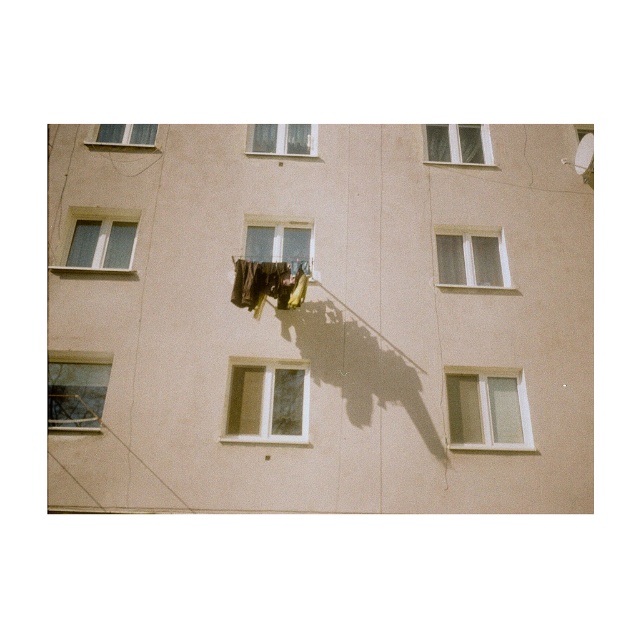
Question: Which object is positioned closest to the white plastic window at upper center?

Choices:
 (A) transparent plastic window at center
 (B) clear glass window at upper left

Answer: (A)

Question: Which point appears farthest from the camera in this image?

Choices:
 (A) (289, 154)
 (B) (259, 381)

Answer: (A)

Question: From the image, what is the correct spatial relationship of white plastic window at center in relation to matte glass window at upper left?

Choices:
 (A) above
 (B) below

Answer: (B)

Question: Which point is farther to the camera?

Choices:
 (A) (279, 257)
 (B) (238, 401)
 (C) (275, 125)
 (D) (481, 264)

Answer: (C)

Question: Can you confirm if white plastic window at upper right is bigger than transparent plastic window at center?

Choices:
 (A) no
 (B) yes

Answer: (B)

Question: Can you confirm if transparent plastic window at center is wider than clear glass window at upper center?

Choices:
 (A) yes
 (B) no

Answer: (B)